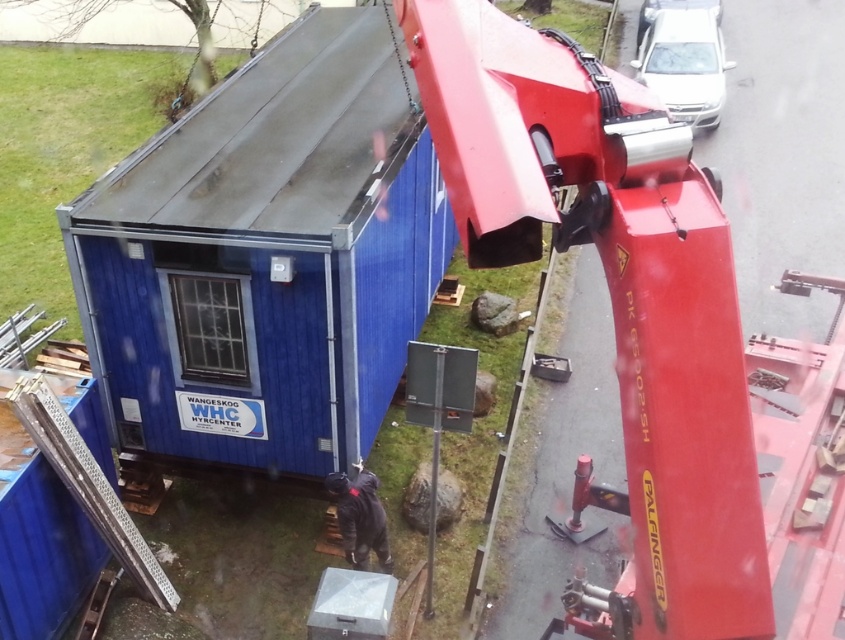
Question: Does metallic red crane arm at upper right have a larger size compared to white glossy car at upper center?

Choices:
 (A) yes
 (B) no

Answer: (B)

Question: Which point is farther to the camera?

Choices:
 (A) dark gray fabric jacket at lower center
 (B) metallic red crane arm at upper right
 (C) white glossy car at upper center
 (D) blue metallic shed at center

Answer: (C)

Question: Which of the following is the closest to the observer?

Choices:
 (A) metallic red crane arm at upper right
 (B) dark gray fabric jacket at lower center

Answer: (A)

Question: Does blue metallic shed at center appear over white glossy car at upper right?

Choices:
 (A) yes
 (B) no

Answer: (B)

Question: Which of the following is the farthest from the observer?

Choices:
 (A) (702, 307)
 (B) (636, 22)
 (C) (282, 371)
 (D) (374, 477)

Answer: (B)

Question: Does blue metallic shed at center appear on the left side of white glossy car at upper center?

Choices:
 (A) no
 (B) yes

Answer: (B)